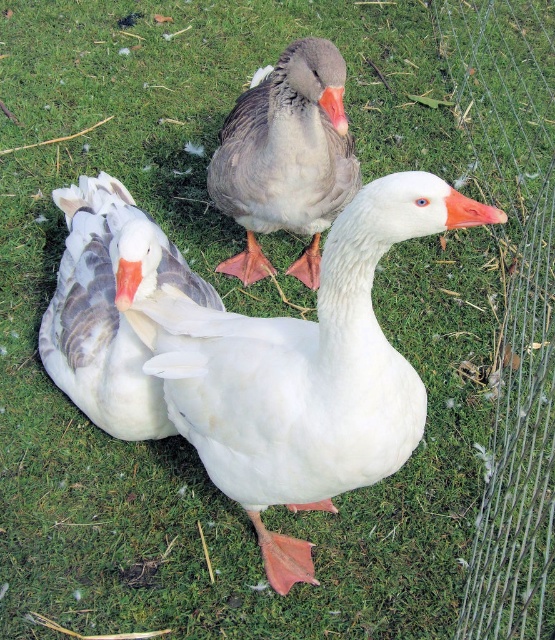
Question: Can you confirm if white matte goose at center is bigger than gray matte goose at center?

Choices:
 (A) no
 (B) yes

Answer: (A)

Question: Based on their relative distances, which object is farther from the wire mesh fence at right?

Choices:
 (A) white matte duck at center
 (B) white matte goose at center
 (C) gray matte goose at center

Answer: (B)

Question: Does white matte duck at center appear on the right side of wire mesh fence at right?

Choices:
 (A) yes
 (B) no

Answer: (B)

Question: In this image, where is white matte duck at center located relative to gray matte goose at center?

Choices:
 (A) right
 (B) left

Answer: (B)

Question: Among these points, which one is nearest to the camera?

Choices:
 (A) (457, 636)
 (B) (88, 340)

Answer: (A)

Question: Which object is closer to the camera taking this photo?

Choices:
 (A) white matte duck at center
 (B) white matte goose at center
 (C) wire mesh fence at right
 (D) gray matte goose at center

Answer: (A)